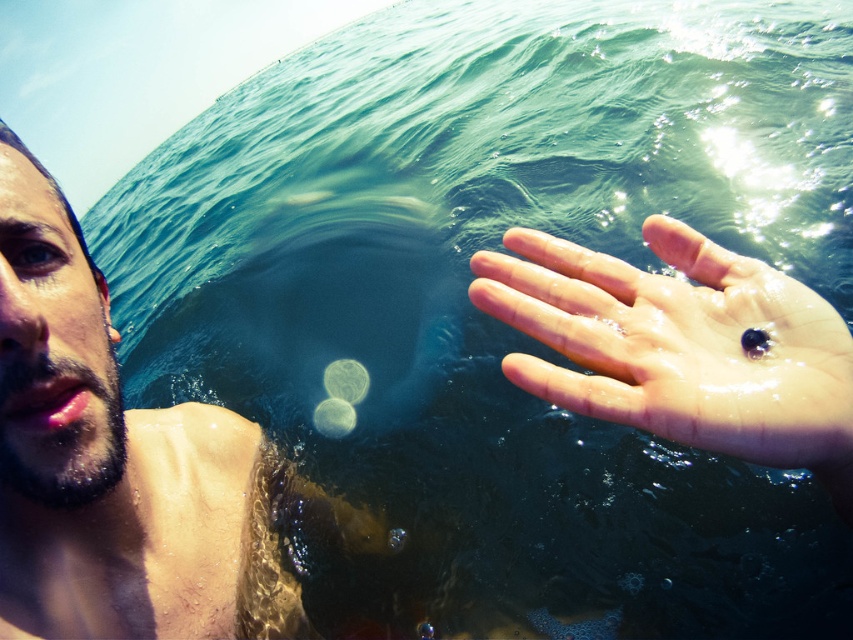
Question: Is shiny wet skin at left below glossy skin hand at right?

Choices:
 (A) yes
 (B) no

Answer: (A)

Question: Does shiny wet skin at left lie behind glossy skin hand at right?

Choices:
 (A) no
 (B) yes

Answer: (B)

Question: Is shiny wet skin at left behind glossy skin hand at right?

Choices:
 (A) yes
 (B) no

Answer: (A)

Question: Which of the following is the closest to the observer?

Choices:
 (A) [775, 445]
 (B) [19, 257]

Answer: (A)

Question: Among these points, which one is farthest from the camera?

Choices:
 (A) (547, 273)
 (B) (86, 445)

Answer: (B)